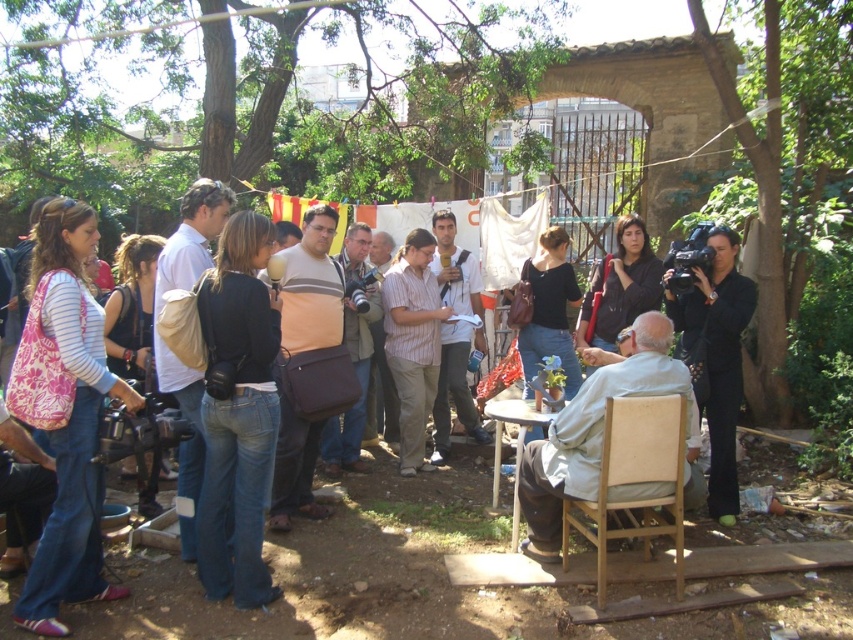
Question: Which object is positioned farthest from the matte black camera at center?

Choices:
 (A) black suit at right
 (B) denim jeans at center
 (C) light blue fabric at center

Answer: (A)

Question: Among these objects, which one is nearest to the camera?

Choices:
 (A) black suit at right
 (B) denim jeans at center
 (C) matte black camera at center
 (D) light blue fabric at center

Answer: (C)

Question: Is matte black camera at center to the right of denim jeans at center from the viewer's perspective?

Choices:
 (A) yes
 (B) no

Answer: (A)

Question: Based on their relative distances, which object is farther from the light blue fabric at center?

Choices:
 (A) matte black camera at center
 (B) denim jeans at center
 (C) black suit at right

Answer: (B)

Question: Does denim jeans at center appear on the left side of light blue fabric at center?

Choices:
 (A) yes
 (B) no

Answer: (A)

Question: Observing the image, what is the correct spatial positioning of denim jeans at center in reference to black suit at right?

Choices:
 (A) right
 (B) left

Answer: (B)